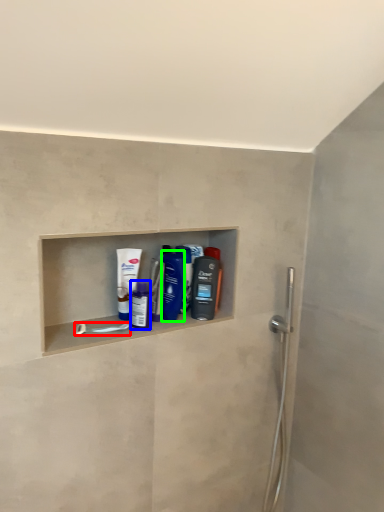
Question: Based on their relative distances, which object is farther from towel bar (highlighted by a red box)? Choose from mouthwash (highlighted by a blue box) and mouthwash (highlighted by a green box).

Choices:
 (A) mouthwash
 (B) mouthwash

Answer: (B)